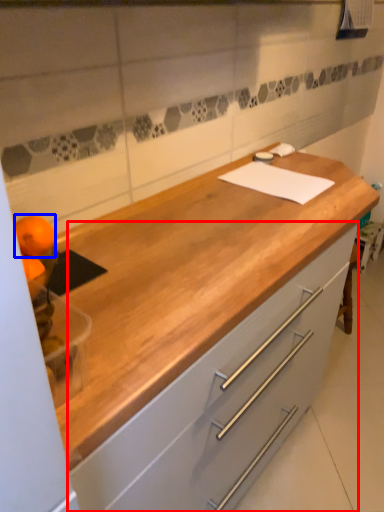
Question: Which of the following is the closest to the observer, cabinetry (highlighted by a red box) or orange (highlighted by a blue box)?

Choices:
 (A) cabinetry
 (B) orange

Answer: (B)